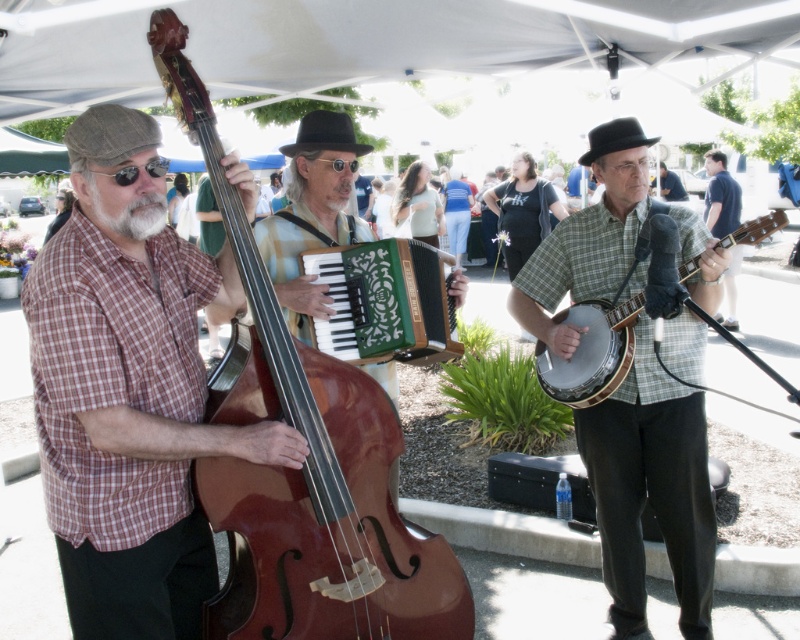
Between shiny brown wood cello at left and green matte accordion at center, which one appears on the right side from the viewer's perspective?

From the viewer's perspective, green matte accordion at center appears more on the right side.

Does point (320, 628) come in front of point (413, 252)?

Yes, it is in front of point (413, 252).

This screenshot has height=640, width=800. Describe the element at coordinates (306, 460) in the screenshot. I see `shiny brown wood cello at left` at that location.

Where is `shiny brown wood cello at left`? This screenshot has width=800, height=640. shiny brown wood cello at left is located at coordinates (306, 460).

Can you confirm if green textured accordion at center is wider than white matte beard at left?

Correct, the width of green textured accordion at center exceeds that of white matte beard at left.

Who is lower down, green textured accordion at center or white matte beard at left?

white matte beard at left is lower down.

Is point (372, 236) positioned behind point (122, 218)?

Yes.

In order to click on green textured accordion at center in this screenshot , I will do `click(312, 212)`.

Does matte plaid shirt at left appear on the left side of shiny brown wood cello at left?

Indeed, matte plaid shirt at left is positioned on the left side of shiny brown wood cello at left.

Is matte plaid shirt at left shorter than shiny brown wood cello at left?

Yes, matte plaid shirt at left is shorter than shiny brown wood cello at left.

Describe the element at coordinates (130, 396) in the screenshot. The width and height of the screenshot is (800, 640). I see `matte plaid shirt at left` at that location.

Identify the location of matte plaid shirt at left. This screenshot has height=640, width=800. (130, 396).